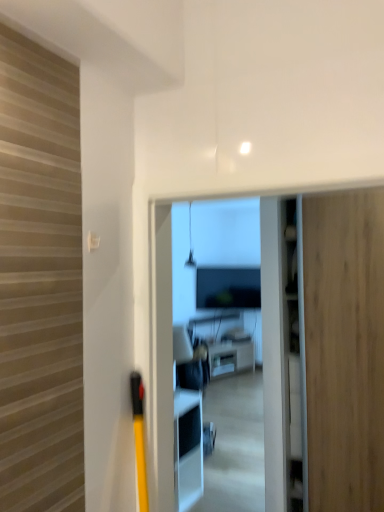
Question: Is white glossy coffee table at center taller than wooden door at right?

Choices:
 (A) yes
 (B) no

Answer: (B)

Question: Is white glossy coffee table at center not inside wooden door at right?

Choices:
 (A) no
 (B) yes

Answer: (B)

Question: From a real-world perspective, is white glossy coffee table at center located higher than wooden door at right?

Choices:
 (A) yes
 (B) no

Answer: (B)

Question: Can wooden door at right be found inside white glossy coffee table at center?

Choices:
 (A) no
 (B) yes

Answer: (A)

Question: Does white glossy coffee table at center have a greater width compared to wooden door at right?

Choices:
 (A) yes
 (B) no

Answer: (B)

Question: Can you confirm if white glossy coffee table at center is shorter than wooden door at right?

Choices:
 (A) no
 (B) yes

Answer: (B)

Question: From a real-world perspective, is wooden door at right physically above white glossy coffee table at center?

Choices:
 (A) yes
 (B) no

Answer: (A)

Question: Can you see wooden door at right touching white glossy coffee table at center?

Choices:
 (A) yes
 (B) no

Answer: (B)

Question: Is wooden door at right at the left side of white glossy coffee table at center?

Choices:
 (A) no
 (B) yes

Answer: (A)

Question: Is wooden door at right not near white glossy coffee table at center?

Choices:
 (A) yes
 (B) no

Answer: (A)

Question: From a real-world perspective, is wooden door at right beneath white glossy coffee table at center?

Choices:
 (A) yes
 (B) no

Answer: (B)

Question: Does wooden door at right turn towards white glossy coffee table at center?

Choices:
 (A) no
 (B) yes

Answer: (A)

Question: Is point [x=238, y=359] positioned closer to the camera than point [x=314, y=226]?

Choices:
 (A) farther
 (B) closer

Answer: (A)